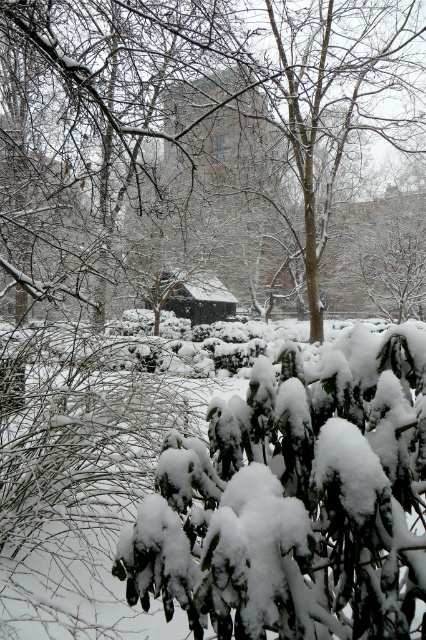
Question: Does snow-covered tree at center appear over white fluffy bush at center?

Choices:
 (A) no
 (B) yes

Answer: (B)

Question: Among these points, which one is farthest from the camera?

Choices:
 (A) (204, 305)
 (B) (319, 164)

Answer: (A)

Question: Among these points, which one is nearest to the camera?

Choices:
 (A) (379, 625)
 (B) (80, 232)
 (C) (175, 296)

Answer: (A)

Question: Does white fluffy bush at center lie in front of dark brown wooden hut at center?

Choices:
 (A) no
 (B) yes

Answer: (B)

Question: Estimate the real-world distances between objects in this image. Which object is closer to the dark brown wooden hut at center?

Choices:
 (A) snow-covered tree at center
 (B) white fluffy bush at center

Answer: (A)

Question: Can you confirm if snow-covered tree at center is positioned above white fluffy bush at center?

Choices:
 (A) no
 (B) yes

Answer: (B)